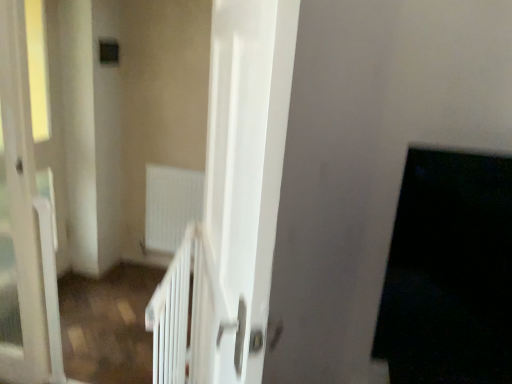
Question: Is black matte door at right turned away from transparent glass screen door at left, placed as the 2th screen door when sorted from right to left?

Choices:
 (A) yes
 (B) no

Answer: (B)

Question: Does black matte door at right have a lesser width compared to transparent glass screen door at left, placed as the 2th screen door when sorted from right to left?

Choices:
 (A) yes
 (B) no

Answer: (B)

Question: Can you confirm if black matte door at right is smaller than transparent glass screen door at left, which is the 1th screen door in left-to-right order?

Choices:
 (A) yes
 (B) no

Answer: (A)

Question: Is black matte door at right further to camera compared to transparent glass screen door at left, placed as the 2th screen door when sorted from right to left?

Choices:
 (A) no
 (B) yes

Answer: (A)

Question: Considering the relative sizes of black matte door at right and transparent glass screen door at left, placed as the 2th screen door when sorted from right to left, in the image provided, is black matte door at right shorter than transparent glass screen door at left, placed as the 2th screen door when sorted from right to left,?

Choices:
 (A) yes
 (B) no

Answer: (A)

Question: Looking at the image, does white matte radiator at center seem bigger or smaller compared to transparent glass screen door at left, placed as the 2th screen door when sorted from right to left?

Choices:
 (A) small
 (B) big

Answer: (A)

Question: Considering their positions, is white matte radiator at center located in front of or behind transparent glass screen door at left, which is the 1th screen door in left-to-right order?

Choices:
 (A) front
 (B) behind

Answer: (B)

Question: Is point (163, 175) positioned closer to the camera than point (0, 221)?

Choices:
 (A) farther
 (B) closer

Answer: (A)

Question: From their relative heights in the image, would you say white matte radiator at center is taller or shorter than transparent glass screen door at left, which is the 1th screen door in left-to-right order?

Choices:
 (A) tall
 (B) short

Answer: (B)

Question: Is white glossy door at center, which is the first screen door in right-to-left order, in front of or behind transparent glass screen door at left, which is the 1th screen door in left-to-right order, in the image?

Choices:
 (A) behind
 (B) front

Answer: (B)

Question: Based on their sizes in the image, would you say white glossy door at center, which is the first screen door in right-to-left order, is bigger or smaller than transparent glass screen door at left, placed as the 2th screen door when sorted from right to left?

Choices:
 (A) big
 (B) small

Answer: (A)

Question: Is point (248, 205) closer or farther from the camera than point (25, 56)?

Choices:
 (A) farther
 (B) closer

Answer: (B)

Question: Is white glossy door at center, which is the first screen door in right-to-left order, wider or thinner than transparent glass screen door at left, which is the 1th screen door in left-to-right order?

Choices:
 (A) thin
 (B) wide

Answer: (A)

Question: Do you think transparent glass screen door at left, placed as the 2th screen door when sorted from right to left, is within white matte radiator at center, or outside of it?

Choices:
 (A) outside
 (B) inside

Answer: (A)

Question: Looking at the image, does transparent glass screen door at left, which is the 1th screen door in left-to-right order, seem bigger or smaller compared to white matte radiator at center?

Choices:
 (A) small
 (B) big

Answer: (B)